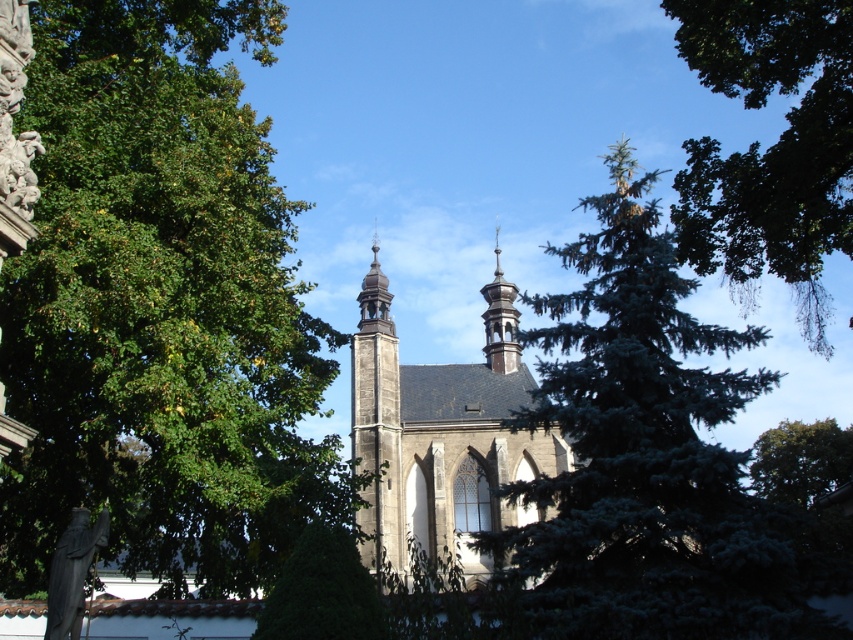
Question: Is stone church at center bigger than smooth gray stone bell tower at center?

Choices:
 (A) yes
 (B) no

Answer: (A)

Question: Which point is closer to the camera?

Choices:
 (A) green leafy tree at left
 (B) green leafy tree at upper right
 (C) dark gray stone bell tower at center

Answer: (A)

Question: Does stone church at center appear on the left side of dark gray stone bell tower at center?

Choices:
 (A) no
 (B) yes

Answer: (A)

Question: Which of the following is the farthest from the observer?

Choices:
 (A) green leafy tree at upper right
 (B) smooth gray stone bell tower at center
 (C) green needle-like at center
 (D) stone church at center

Answer: (B)

Question: Is green needle-like at center to the right of smooth gray stone bell tower at center from the viewer's perspective?

Choices:
 (A) yes
 (B) no

Answer: (A)

Question: Which of the following is the farthest from the observer?

Choices:
 (A) green leafy tree at left
 (B) green leafy tree at upper right
 (C) dark gray stone bell tower at center

Answer: (C)